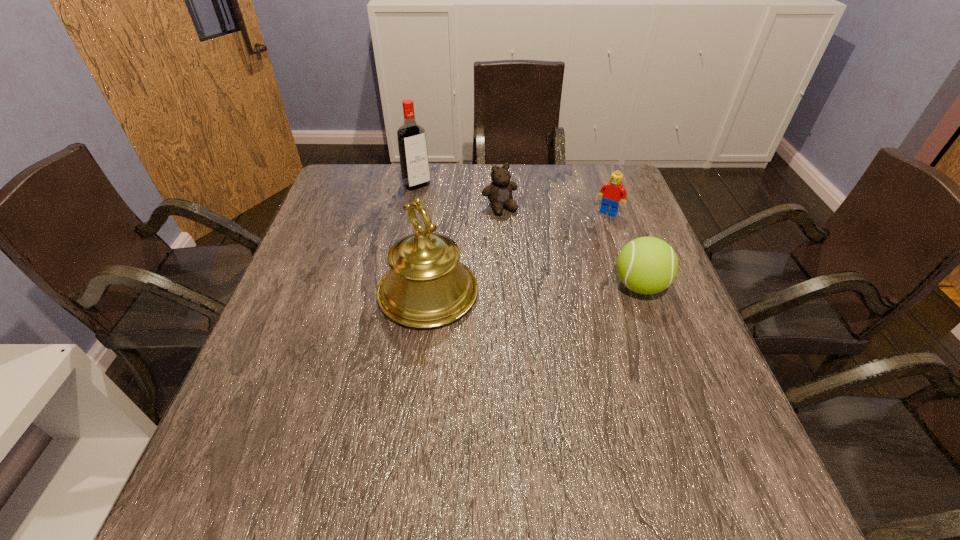
Identify the location of free space between the tennis ball and the farthest object. This screenshot has width=960, height=540. (528, 235).

Where is `free point between the teddy bear and the tennis ball`? The image size is (960, 540). free point between the teddy bear and the tennis ball is located at coordinates (569, 247).

The height and width of the screenshot is (540, 960). In order to click on blank region between the teddy bear and the bell in this screenshot , I will do `click(464, 251)`.

The image size is (960, 540). What are the coordinates of `unoccupied position between the tennis ball and the bell` in the screenshot? It's located at (534, 289).

Locate an element on the screen. This screenshot has height=540, width=960. free spot between the tennis ball and the teddy bear is located at coordinates (569, 247).

Where is `object that is the closest to the teddy bear`? This screenshot has width=960, height=540. object that is the closest to the teddy bear is located at coordinates (413, 154).

Locate an element on the screen. object that ranks as the second closest to the tennis ball is located at coordinates point(499,192).

The image size is (960, 540). What are the coordinates of `vacant region that satisfies the following two spatial constraints: 1. on the front side of the teddy bear; 2. on the right side of the Lego` in the screenshot? It's located at (500, 212).

Identify the location of free spot that satisfies the following two spatial constraints: 1. on the front side of the bell; 2. on the right side of the farthest object. The height and width of the screenshot is (540, 960). (396, 293).